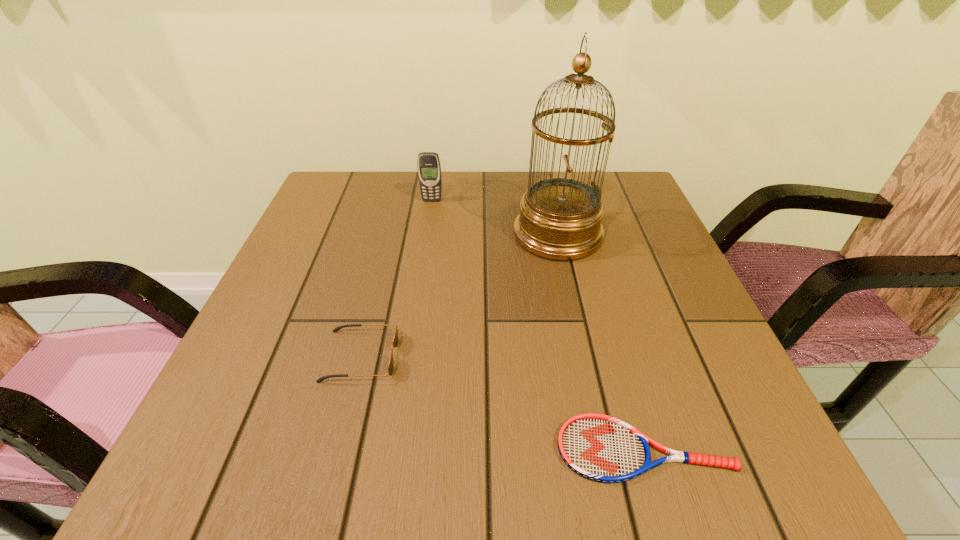
Locate an element on the screen. This screenshot has width=960, height=540. vacant space situated 0.310m with an open door on the birdcage is located at coordinates (380, 234).

Locate an element on the screen. free spot located 0.380m on the screen of the cellular telephone is located at coordinates (416, 310).

Find the location of a particular element. This screenshot has height=540, width=960. vacant position located on the front-facing side of the third tallest object is located at coordinates (500, 356).

Locate an element on the screen. Image resolution: width=960 pixels, height=540 pixels. vacant position located on the left of the shortest object is located at coordinates (357, 449).

At what (x,y) coordinates should I click in order to perform the action: click on birdcage present at the far edge. Please return your answer as a coordinate pair (x, y). This screenshot has height=540, width=960. Looking at the image, I should click on (560, 218).

Find the location of a particular element. The width and height of the screenshot is (960, 540). cellular telephone present at the far edge is located at coordinates pos(429,168).

You are a GUI agent. You are given a task and a screenshot of the screen. Output one action in this format:
    pyautogui.click(x=<x>, y=<y>)
    Task: Click on the object located at the near edge
    
    Given the screenshot: What is the action you would take?
    pyautogui.click(x=598, y=447)

This screenshot has width=960, height=540. I want to click on object that is at the left edge, so click(x=395, y=342).

Locate an element on the screen. birdcage that is at the right edge is located at coordinates (560, 218).

Where is `tennis racket that is at the right edge`? tennis racket that is at the right edge is located at coordinates (598, 447).